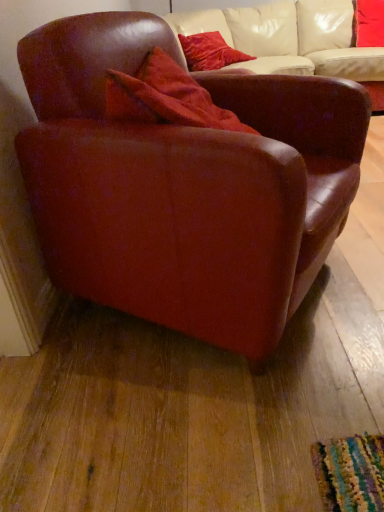
Question: Is there a large distance between leather armchair at left and velvet red pillow at upper center, acting as the 1th pillow starting from the right?

Choices:
 (A) yes
 (B) no

Answer: (A)

Question: Considering the relative sizes of leather armchair at left and velvet red pillow at upper center, acting as the 1th pillow starting from the right, in the image provided, is leather armchair at left shorter than velvet red pillow at upper center, acting as the 1th pillow starting from the right,?

Choices:
 (A) yes
 (B) no

Answer: (B)

Question: Is leather armchair at left smaller than velvet red pillow at upper center, acting as the 1th pillow starting from the right?

Choices:
 (A) no
 (B) yes

Answer: (A)

Question: Is leather armchair at left oriented towards velvet red pillow at upper center, the second pillow positioned from the left?

Choices:
 (A) yes
 (B) no

Answer: (B)

Question: From the image's perspective, does leather armchair at left appear lower than velvet red pillow at upper center, acting as the 1th pillow starting from the right?

Choices:
 (A) yes
 (B) no

Answer: (A)

Question: From a real-world perspective, is leather armchair at left positioned above or below velvet red pillow at upper center, which is the 2th pillow from right to left?

Choices:
 (A) above
 (B) below

Answer: (B)

Question: In terms of height, does leather armchair at left look taller or shorter compared to velvet red pillow at upper center, the first pillow in the left-to-right sequence?

Choices:
 (A) short
 (B) tall

Answer: (B)

Question: From the image's perspective, relative to velvet red pillow at upper center, which is the 2th pillow from right to left, is leather armchair at left above or below?

Choices:
 (A) below
 (B) above

Answer: (A)

Question: Is leather armchair at left to the left or to the right of velvet red pillow at upper center, which is the 2th pillow from right to left, in the image?

Choices:
 (A) right
 (B) left

Answer: (B)

Question: In terms of size, does velvet red pillow at upper center, which is the 2th pillow from right to left, appear bigger or smaller than velvet red pillow at upper center, acting as the 1th pillow starting from the right?

Choices:
 (A) small
 (B) big

Answer: (A)

Question: Considering their positions, is velvet red pillow at upper center, which is the 2th pillow from right to left, located in front of or behind velvet red pillow at upper center, the second pillow positioned from the left?

Choices:
 (A) behind
 (B) front

Answer: (B)

Question: Is point (241, 55) positioned closer to the camera than point (367, 31)?

Choices:
 (A) farther
 (B) closer

Answer: (B)

Question: From the image's perspective, is velvet red pillow at upper center, which is the 2th pillow from right to left, above or below velvet red pillow at upper center, the second pillow positioned from the left?

Choices:
 (A) below
 (B) above

Answer: (A)

Question: Is velvet red pillow at upper center, the second pillow positioned from the left, wider or thinner than leather armchair at left?

Choices:
 (A) thin
 (B) wide

Answer: (A)

Question: Visually, is velvet red pillow at upper center, acting as the 1th pillow starting from the right, positioned to the left or to the right of leather armchair at left?

Choices:
 (A) right
 (B) left

Answer: (A)